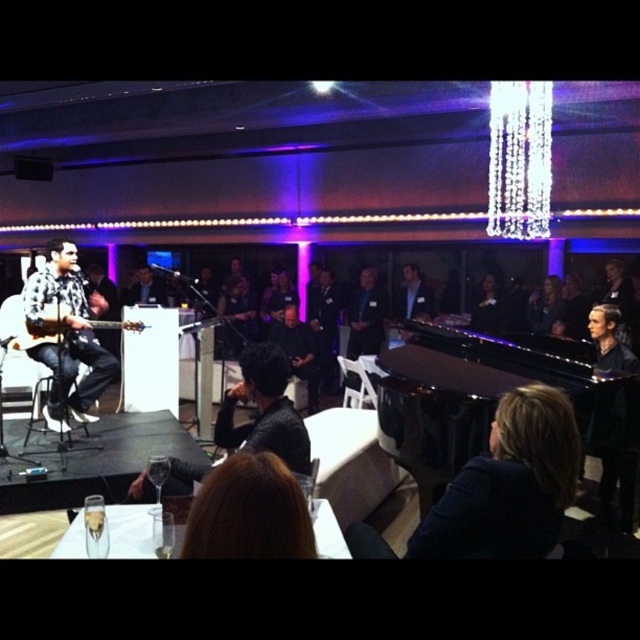
You are a photographer positioned at the center of the stage. You want to capture a photo that includes both the dark blue fabric at lower right and the matte black guitar at left. Given that your camera has a maximum focal length that allows capturing objects within a 10 feet distance range, will you be able to include both objects in the same frame?

The dark blue fabric at lower right is 11.16 feet away from the matte black guitar at left. Since the distance between them exceeds the camera lens focal length range of 10 feet, you cannot capture both objects in the same frame.

You are attending the event and want to take a photo of both the guitarist and the pianist. The guitarist is at point (436, 449) and the pianist is at point (28, 332). Since you want to ensure both are in focus, which point should you focus on to capture both clearly?

You should focus on point (28, 332) because it is farther from the viewer than point (436, 449). By focusing on the farther point, the closer point will also be within the depth of field, ensuring both the guitarist and pianist are in focus.

You are organizing a photo shoot and need to place a large camera setup between the black polished piano at center and the smooth black hair at upper right. Based on the scene description, can the camera fit between them if it requires 1.2 meters of space?

The black polished piano at center might be wider than smooth black hair at upper right, but the exact width difference isn